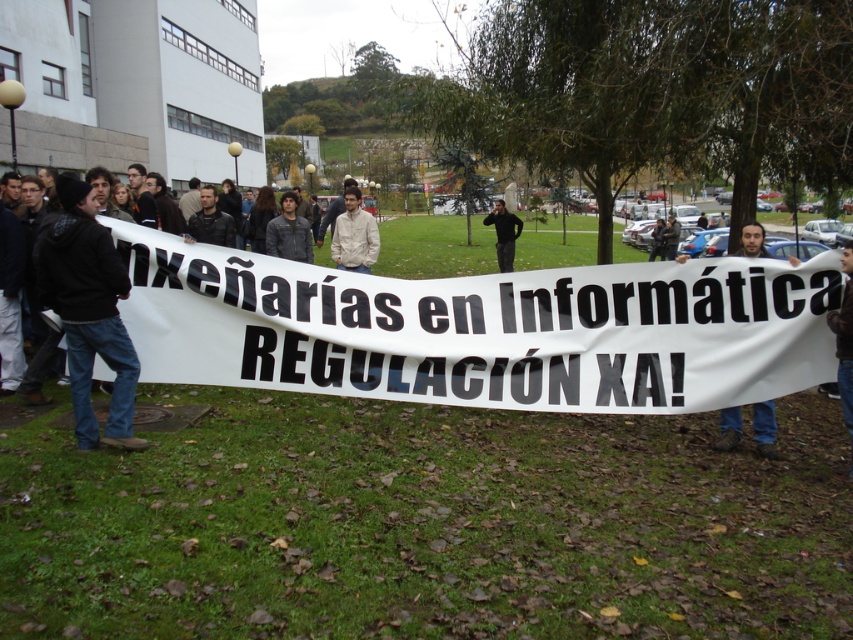
Does beige fabric shirt at center appear on the right side of black leather jacket at center?

No, beige fabric shirt at center is not to the right of black leather jacket at center.

Can you confirm if beige fabric shirt at center is shorter than black leather jacket at center?

Correct, beige fabric shirt at center is not as tall as black leather jacket at center.

This screenshot has width=853, height=640. Identify the location of beige fabric shirt at center. (354, 236).

Is black matte jacket at left above black leather jacket at center?

No, black matte jacket at left is not above black leather jacket at center.

Where is `black matte jacket at left`? The height and width of the screenshot is (640, 853). black matte jacket at left is located at coordinates (88, 310).

You are a GUI agent. You are given a task and a screenshot of the screen. Output one action in this format:
    pyautogui.click(x=<x>, y=<y>)
    Task: Click on the black matte jacket at left
    This screenshot has height=640, width=853.
    Given the screenshot: What is the action you would take?
    pyautogui.click(x=88, y=310)

Can you confirm if beige fabric shirt at center is thinner than black fabric at center?

Indeed, beige fabric shirt at center has a lesser width compared to black fabric at center.

Which of these two, beige fabric shirt at center or black fabric at center, stands taller?

black fabric at center

Is point (335, 232) behind point (503, 221)?

No.

In order to click on beige fabric shirt at center in this screenshot , I will do `click(354, 236)`.